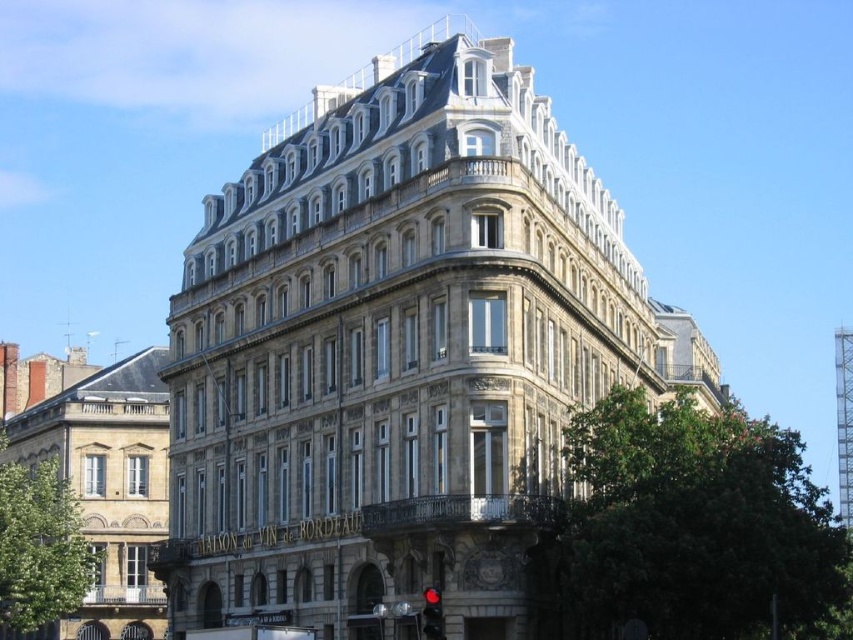
Can you confirm if stone building at center is taller than matte beige building at left?

Yes, stone building at center is taller than matte beige building at left.

Find the location of a particular element. stone building at center is located at coordinates (398, 353).

The height and width of the screenshot is (640, 853). What do you see at coordinates (398, 353) in the screenshot?
I see `stone building at center` at bounding box center [398, 353].

Locate an element on the screen. stone building at center is located at coordinates (398, 353).

Is matte beige building at left below red glass traffic light at lower center?

No, matte beige building at left is not below red glass traffic light at lower center.

This screenshot has width=853, height=640. I want to click on matte beige building at left, so click(x=109, y=486).

In the scene shown: Who is shorter, stone building at center or red glass traffic light at lower center?

red glass traffic light at lower center

Who is higher up, stone building at center or red glass traffic light at lower center?

stone building at center

Is point (250, 275) more distant than point (433, 616)?

Yes, point (250, 275) is behind point (433, 616).

Identify the location of stone building at center. Image resolution: width=853 pixels, height=640 pixels. (398, 353).